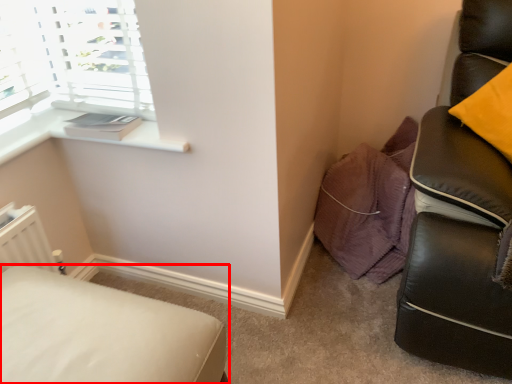
Question: From the image's perspective, where is furniture (annotated by the red box) located in relation to window sill in the image?

Choices:
 (A) below
 (B) above

Answer: (A)